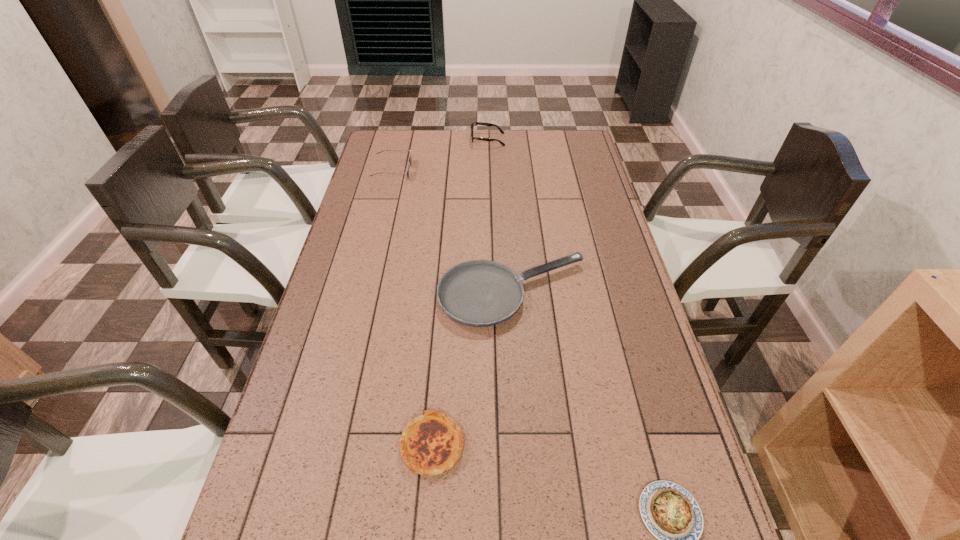
Find the location of `free region at the far right corner`. free region at the far right corner is located at coordinates tap(562, 158).

Locate an element on the screen. The width and height of the screenshot is (960, 540). vacant space in between the frying pan and the taller quiche is located at coordinates (472, 369).

Locate an element on the screen. The width and height of the screenshot is (960, 540). vacant area that lies between the leftmost object and the farthest object is located at coordinates (440, 155).

The image size is (960, 540). Identify the location of free point between the sunglasses and the farthest object. (440, 155).

The height and width of the screenshot is (540, 960). In order to click on vacant region between the third shortest object and the spectacles in this screenshot , I will do `click(500, 217)`.

Select which object is the closest to the fourth nearest object. Please provide its 2D coordinates. Your answer should be formatted as a tuple, i.e. [(x, y)], where the tuple contains the x and y coordinates of a point satisfying the conditions above.

[(477, 123)]

Identify which object is the third nearest to the spectacles. Please provide its 2D coordinates. Your answer should be formatted as a tuple, i.e. [(x, y)], where the tuple contains the x and y coordinates of a point satisfying the conditions above.

[(431, 444)]

Image resolution: width=960 pixels, height=540 pixels. I want to click on vacant position in the image that satisfies the following two spatial constraints: 1. on the lenses of the farthest object; 2. on the back side of the third farthest object, so click(492, 294).

Locate an element on the screen. The image size is (960, 540). vacant space that satisfies the following two spatial constraints: 1. on the lenses of the farthest object; 2. on the back side of the frying pan is located at coordinates (492, 294).

I want to click on vacant space that satisfies the following two spatial constraints: 1. on the front-facing side of the frying pan; 2. on the left side of the second farthest object, so click(361, 294).